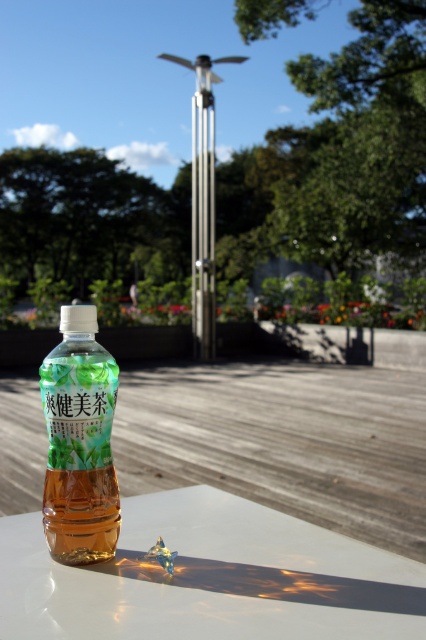
You are holding a small metallic star that is 1 inch in diameter. You want to place it on the white glossy table at lower center so that it is exactly halfway between the bottle and the edge of the table. Is this possible?

The distance between the bottle and the edge of the table is 8.20 inches. Half of this distance is 4.10 inches. Since the metallic star is 1 inch in diameter, placing it exactly halfway would require positioning it at 4.10 inches from both the bottle and the edge. This is possible as the star fits within the available space.

In the scene shown: You are setting up a small table for a picnic and have a white glossy table at lower center and a translucent plastic bottle at center. Which object should you move to make space for a plate?

The white glossy table at lower center is positioned on the right side of the translucent plastic bottle at center. To make space for a plate, you should move the white glossy table at lower center to the right of the translucent plastic bottle at center.

Based on the photo, you are a delivery person who needs to place a package on the table. The package is 2.5 inches wide. Can you fit it between the white glossy table at lower center and the translucent plastic bottle at center?

The distance between the white glossy table at lower center and the translucent plastic bottle at center is 2.22 inches, which is less than the package width of 2.5 inches. Therefore, the package cannot fit in that space.